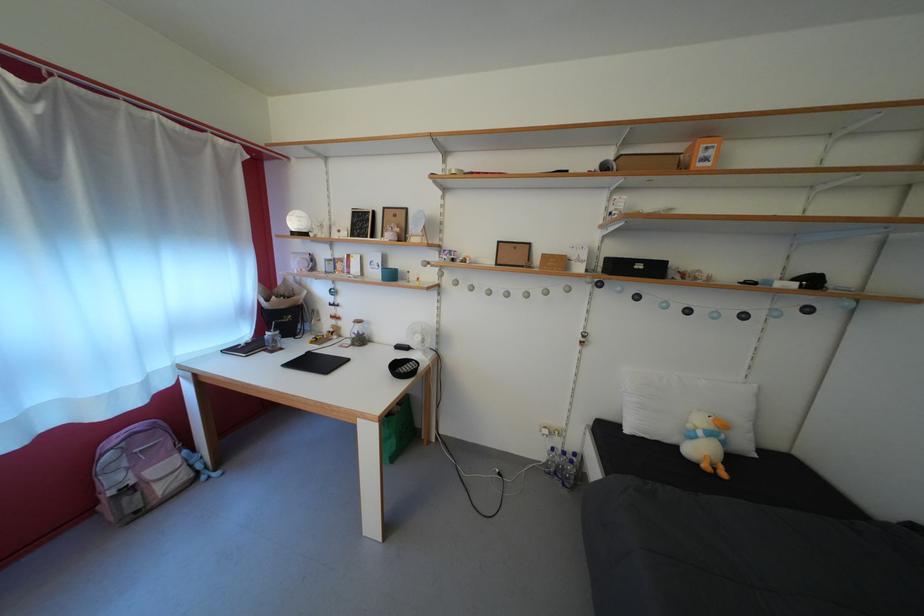
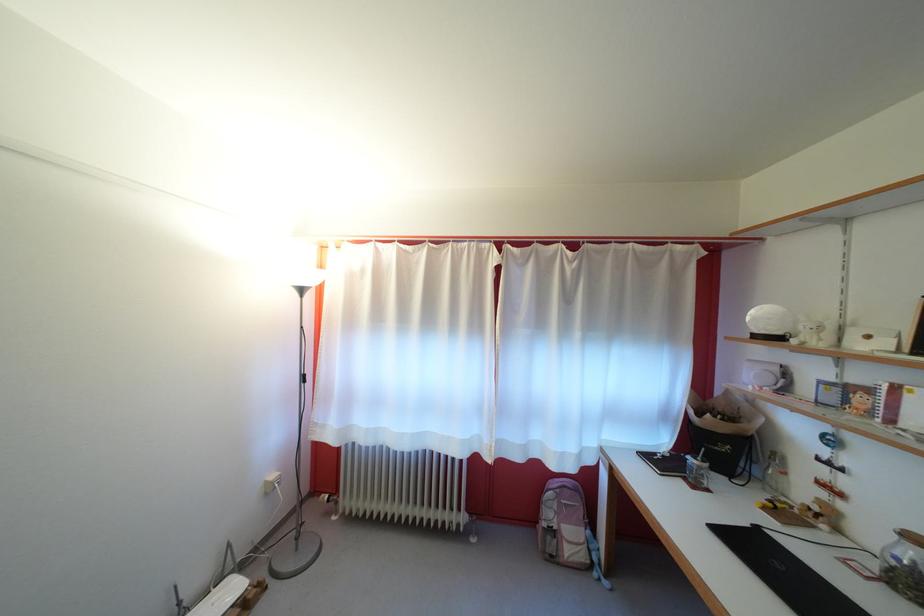
Where in the second image is the point corresponding to [358,347] from the first image?

(881, 570)